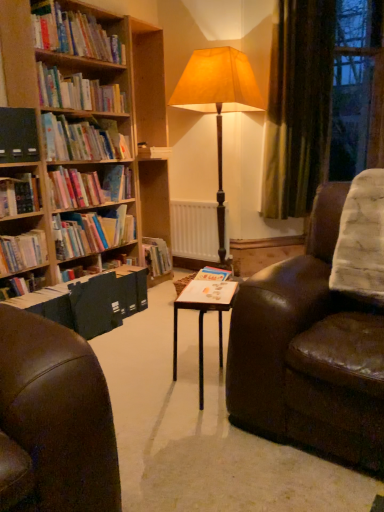
This screenshot has width=384, height=512. I want to click on vacant area situated below black matte book at left, which ranks as the second paperback book in bottom-to-top order (from a real-world perspective), so click(x=15, y=176).